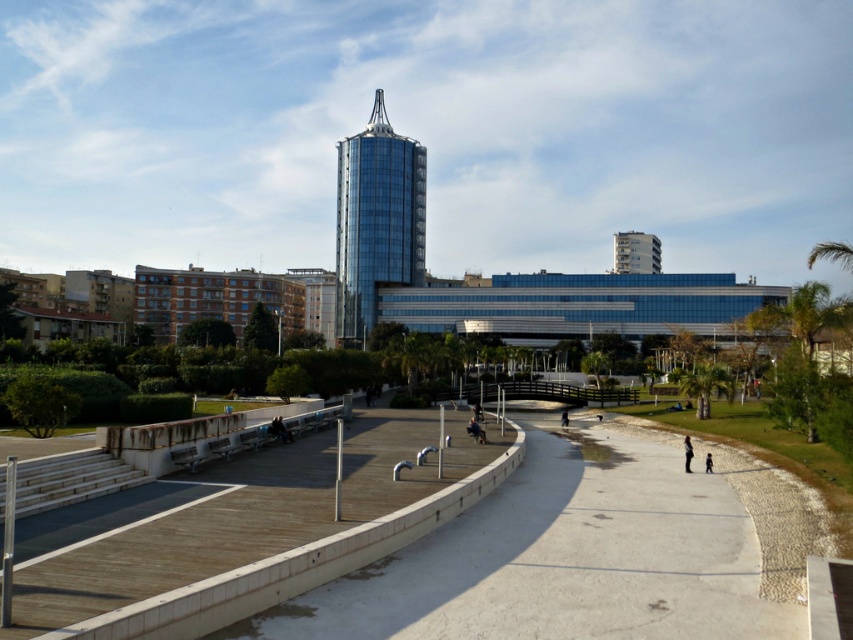
Question: Which object is farther from the camera taking this photo?

Choices:
 (A) smooth concrete path at center
 (B) white concrete building at upper right
 (C) blurred fabric person at lower right

Answer: (B)

Question: Does concrete at center appear over dark blue jeans at center?

Choices:
 (A) yes
 (B) no

Answer: (B)

Question: Which point appears closest to the camera in this image?

Choices:
 (A) (631, 248)
 (B) (389, 221)
 (C) (463, 522)
 (D) (708, 468)

Answer: (C)

Question: In this image, where is glossy glass tower at center located relative to blurred fabric person at lower right?

Choices:
 (A) above
 (B) below

Answer: (A)

Question: Among these objects, which one is farthest from the camera?

Choices:
 (A) white concrete building at upper right
 (B) dark gray fabric jacket at lower right
 (C) blurred figure at center
 (D) blurred fabric person at lower right

Answer: (A)

Question: Is glossy glass tower at center bigger than dark gray fabric jacket at lower right?

Choices:
 (A) no
 (B) yes

Answer: (B)